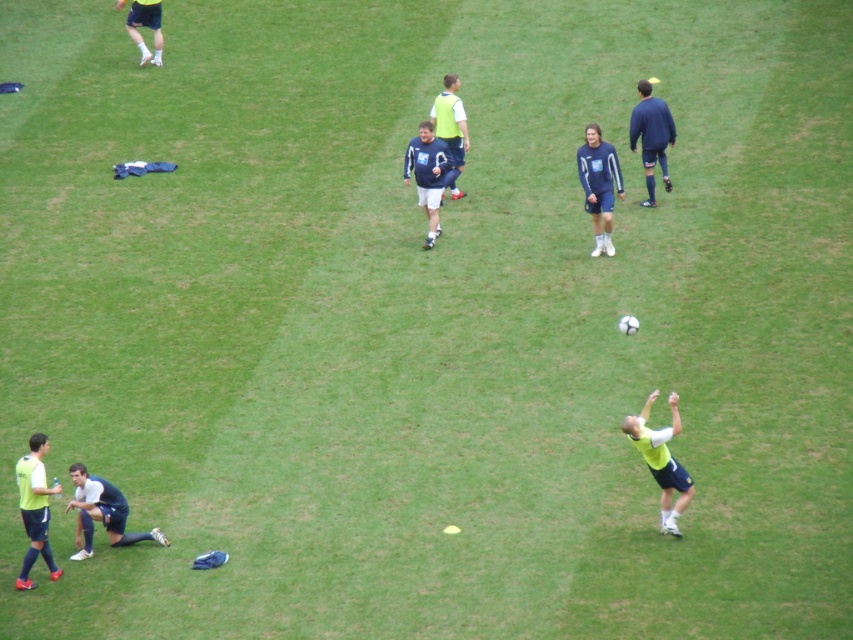
You are a photographer setting up for a soccer game. You need to capture a closeup of the dark blue uniform at lower left and the matte green shorts at lower left. Which object should you zoom in on to ensure it fills the frame more without moving the camera?

The dark blue uniform at lower left should be zoomed in on because its width is larger than the matte green shorts at lower left, so it will fill the frame more when zoomed in.

You are standing at the position of the viewer in the soccer training session. There is a green matte shirt at lower right that you want to hand a water bottle to. If you can throw the water bottle 15 meters, will you be able to reach them?

The green matte shirt at lower right and viewer are 14.18 meters apart from each other, so yes, you can throw the water bottle to the green matte shirt at lower right since the distance is within your 15 meters range.